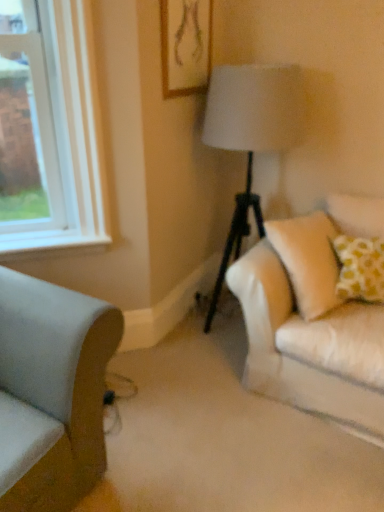
Question: Considering the relative sizes of wooden framed artwork at upper center and light gray fabric couch at lower left in the image provided, is wooden framed artwork at upper center shorter than light gray fabric couch at lower left?

Choices:
 (A) no
 (B) yes

Answer: (B)

Question: Does wooden framed artwork at upper center have a larger size compared to light gray fabric couch at lower left?

Choices:
 (A) yes
 (B) no

Answer: (B)

Question: Does wooden framed artwork at upper center appear on the left side of light gray fabric couch at lower left?

Choices:
 (A) yes
 (B) no

Answer: (B)

Question: Is the depth of wooden framed artwork at upper center less than that of light gray fabric couch at lower left?

Choices:
 (A) yes
 (B) no

Answer: (B)

Question: From a real-world perspective, does wooden framed artwork at upper center sit lower than light gray fabric couch at lower left?

Choices:
 (A) no
 (B) yes

Answer: (A)

Question: Is light gray fabric couch at lower left wider or thinner than wooden framed artwork at upper center?

Choices:
 (A) wide
 (B) thin

Answer: (A)

Question: From a real-world perspective, is light gray fabric couch at lower left positioned above or below wooden framed artwork at upper center?

Choices:
 (A) above
 (B) below

Answer: (B)

Question: Is point (104, 446) positioned closer to the camera than point (172, 88)?

Choices:
 (A) closer
 (B) farther

Answer: (A)

Question: Is light gray fabric couch at lower left inside or outside of wooden framed artwork at upper center?

Choices:
 (A) outside
 (B) inside

Answer: (A)

Question: From the image's perspective, relative to light gray fabric couch at lower left, is white smooth window sill at left above or below?

Choices:
 (A) below
 (B) above

Answer: (B)

Question: Is white smooth window sill at left in front of or behind light gray fabric couch at lower left in the image?

Choices:
 (A) behind
 (B) front

Answer: (A)

Question: From a real-world perspective, is white smooth window sill at left positioned above or below light gray fabric couch at lower left?

Choices:
 (A) below
 (B) above

Answer: (B)

Question: Is white smooth window sill at left bigger or smaller than light gray fabric couch at lower left?

Choices:
 (A) small
 (B) big

Answer: (A)

Question: Is wooden framed artwork at upper center in front of or behind light gray fabric couch at lower left in the image?

Choices:
 (A) behind
 (B) front

Answer: (A)

Question: Considering the positions of wooden framed artwork at upper center and light gray fabric couch at lower left in the image, is wooden framed artwork at upper center bigger or smaller than light gray fabric couch at lower left?

Choices:
 (A) big
 (B) small

Answer: (B)